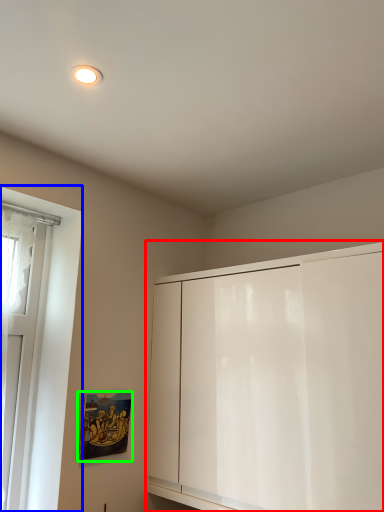
Question: Which object is the farthest from cabinetry (highlighted by a red box)? Choose among these: window (highlighted by a blue box) or picture frame (highlighted by a green box).

Choices:
 (A) window
 (B) picture frame

Answer: (A)